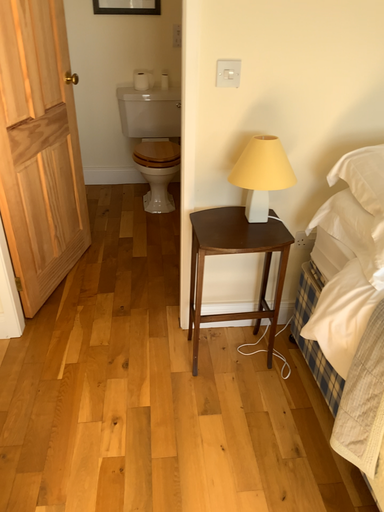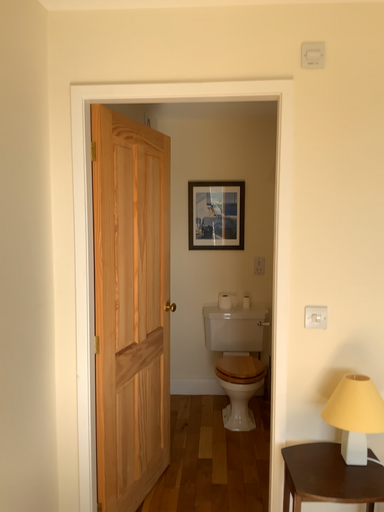
Question: How did the camera likely rotate when shooting the video?

Choices:
 (A) rotated downward
 (B) rotated upward

Answer: (B)